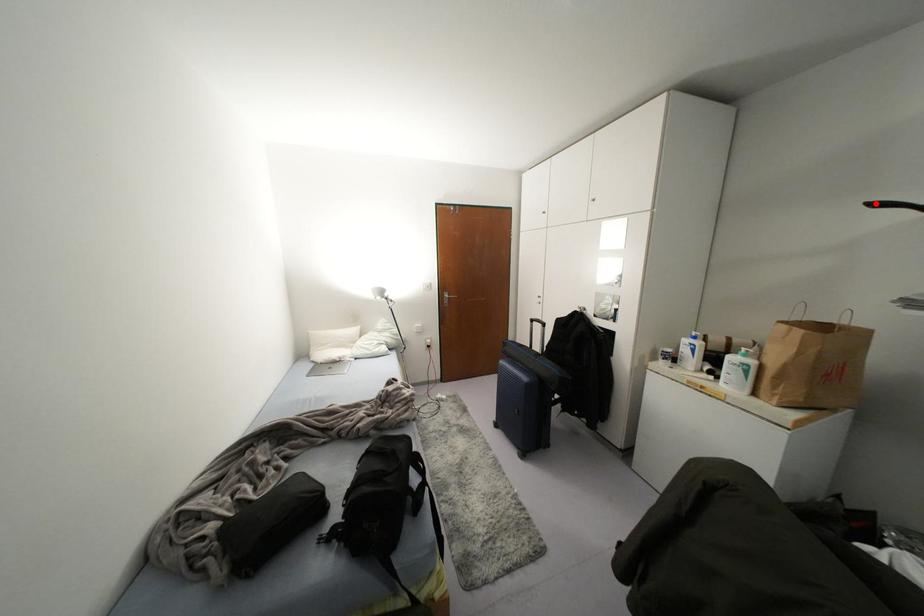
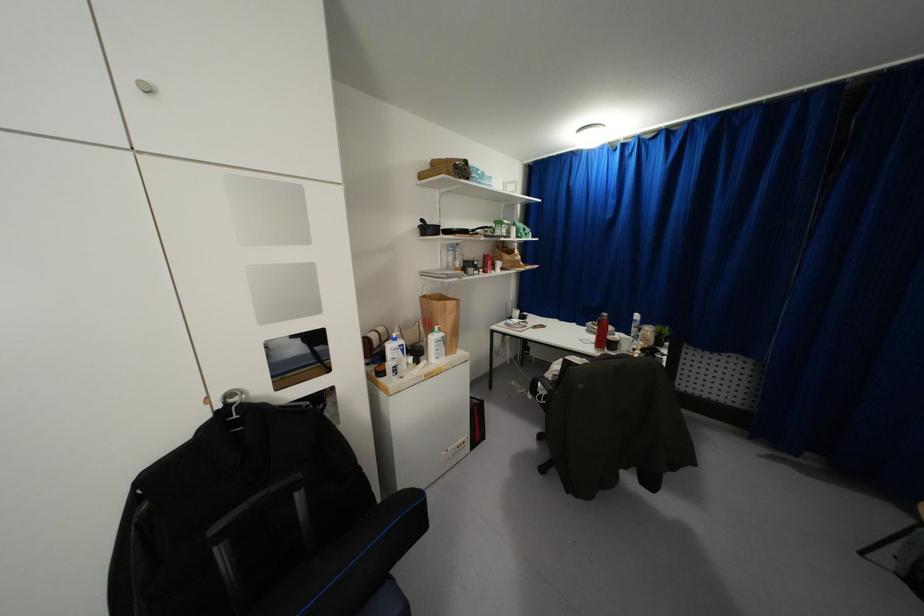
In the second image, find the point that corresponds to the highlighted location in the first image.

(421, 220)